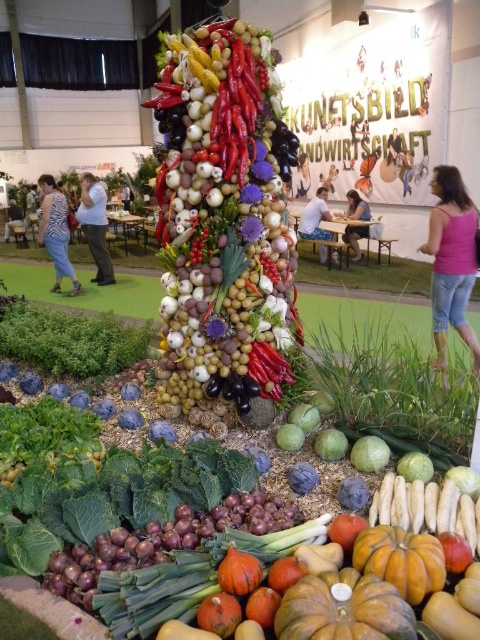
You are standing in front of the vegetable and fruit display. Where is the pink fabric top at right located in the image?

The pink fabric top at right is located at the 2D coordinates point (451, 259) in the image.

You are standing in front of the vegetable and fruit display arranged like a tree. There is a point marked at coordinates (95, 227). What object is located at this point?

The matte white blouse at center is located at point (95, 227).